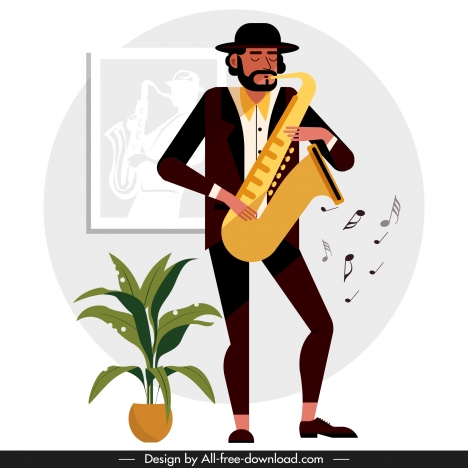
At what (x,y) coordinates should I click in order to perform the action: click on indoor plant leaf. Please return your answer as a coordinate pair (x, y). This screenshot has width=468, height=468. Looking at the image, I should click on (101, 387), (110, 318), (121, 296), (129, 276), (151, 277), (168, 284), (187, 312), (175, 337), (208, 380), (168, 390).